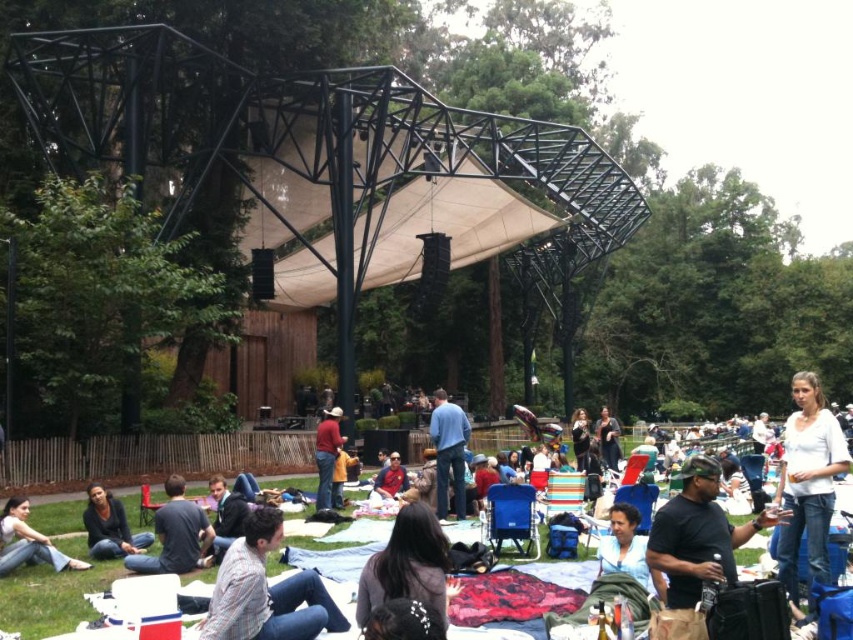
Between dark gray shirt at lower left and black leather jacket at center, which one appears on the right side from the viewer's perspective?

black leather jacket at center is more to the right.

Is dark gray shirt at lower left to the left of black leather jacket at center from the viewer's perspective?

Yes, dark gray shirt at lower left is to the left of black leather jacket at center.

The height and width of the screenshot is (640, 853). Describe the element at coordinates (175, 534) in the screenshot. I see `dark gray shirt at lower left` at that location.

The image size is (853, 640). Identify the location of dark gray shirt at lower left. (175, 534).

Is the position of dark brown hair at center more distant than that of dark gray jeans at lower left?

No, it is in front of dark gray jeans at lower left.

Can you confirm if dark brown hair at center is smaller than dark gray jeans at lower left?

No, dark brown hair at center is not smaller than dark gray jeans at lower left.

Identify the location of dark brown hair at center. (407, 564).

Who is more distant from viewer, (260, 512) or (810, 401)?

Positioned behind is point (810, 401).

Identify the location of plaid shirt at center. (265, 592).

Which is in front, point (271, 536) or point (819, 465)?

Point (271, 536) is more forward.

The width and height of the screenshot is (853, 640). Find the location of `plaid shirt at center`. plaid shirt at center is located at coordinates (265, 592).